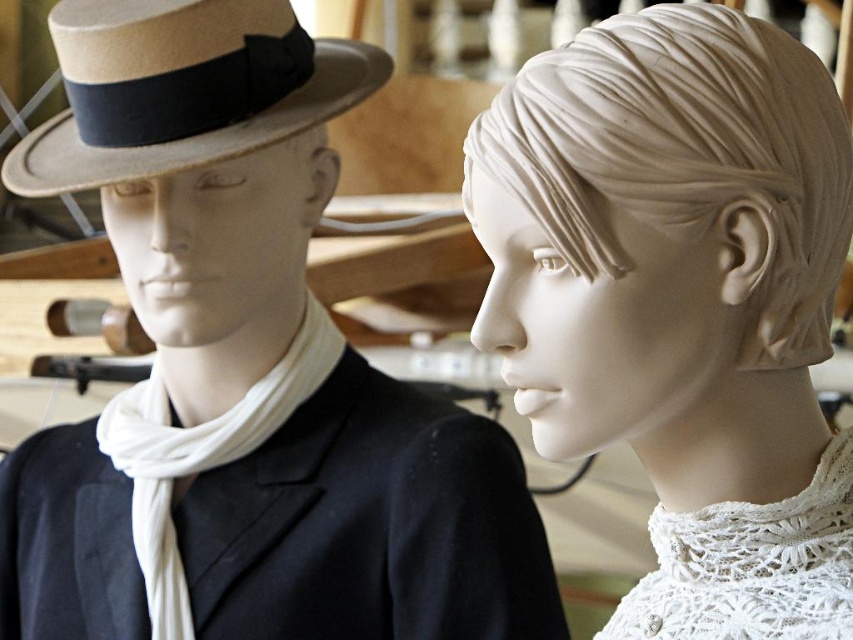
You are a store manager arranging items in the display. You need to ensure that the white marble head at center and the white cotton scarf at left are visible to customers entering the store. Based on their positions, which item is placed higher up?

The white marble head at center is placed higher up than the white cotton scarf at left.

You are standing in front of two mannequin heads displayed side by side. You notice two points marked on them. The first point is at coordinate point [659,310] and the second is at point [113,116]. Which point is closer to you?

Point [659,310] is in front of point [113,116], so it is closer to you.

You are a store employee arranging items on a shelf. You have to place the beige felt fedora at left and the white cotton scarf at left on the shelf. If the shelf has a height limit of 10 cm, can both items be placed without exceeding the height limit?

The beige felt fedora at left has a lesser height compared to white cotton scarf at left. Since the scarf is taller, but the total combined height of both items would depend on their individual heights. However, the description only states their relative heights, not exact measurements. Without knowing the exact heights, it is impossible to determine if they fit within the 10 cm limit.